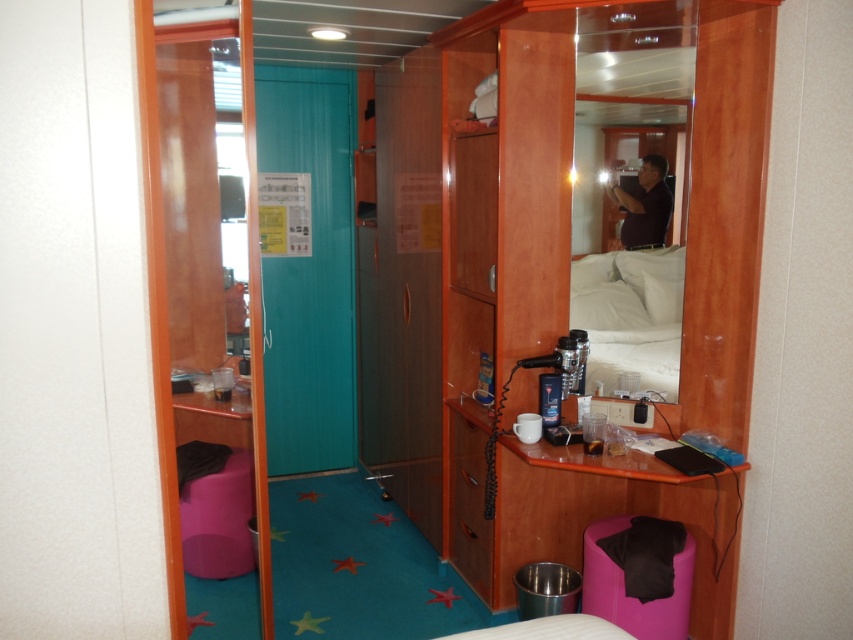
Does point (633, 413) lie in front of point (624, 202)?

That is True.

Describe the element at coordinates (599, 273) in the screenshot. I see `wooden cabinet at center` at that location.

The width and height of the screenshot is (853, 640). Identify the location of wooden cabinet at center. (599, 273).

Who is shorter, white soft bed at center or purple fabric stool at lower right?

Standing shorter between the two is purple fabric stool at lower right.

Does white soft bed at center have a lesser height compared to purple fabric stool at lower right?

Incorrect, white soft bed at center's height does not fall short of purple fabric stool at lower right's.

What do you see at coordinates (630, 316) in the screenshot? The image size is (853, 640). I see `white soft bed at center` at bounding box center [630, 316].

At what (x,y) coordinates should I click in order to perform the action: click on white soft bed at center. Please return your answer as a coordinate pair (x, y). The image size is (853, 640). Looking at the image, I should click on (630, 316).

Which of these two, white soft bed at center or black matte man at upper center, stands taller?

Standing taller between the two is white soft bed at center.

Measure the distance between white soft bed at center and black matte man at upper center.

white soft bed at center and black matte man at upper center are 9.34 inches apart from each other.

At what (x,y) coordinates should I click in order to perform the action: click on white soft bed at center. Please return your answer as a coordinate pair (x, y). Looking at the image, I should click on (630, 316).